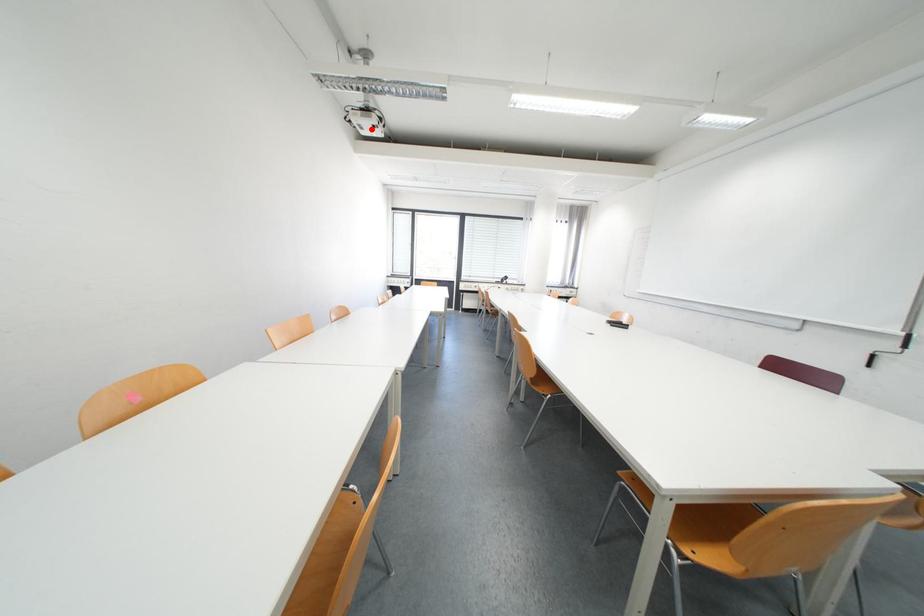
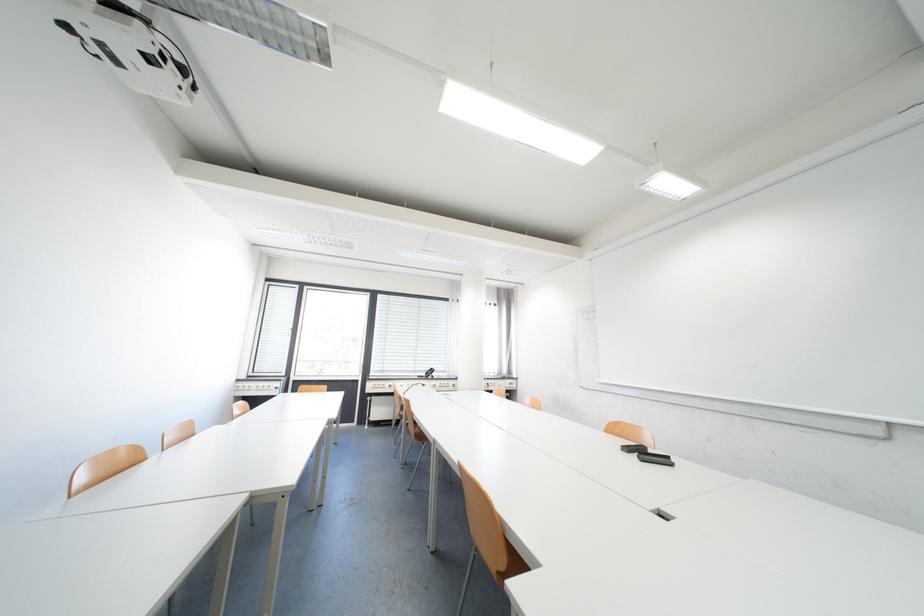
Where in the second image is the point corresponding to the highlighted location from the first image?

(128, 63)